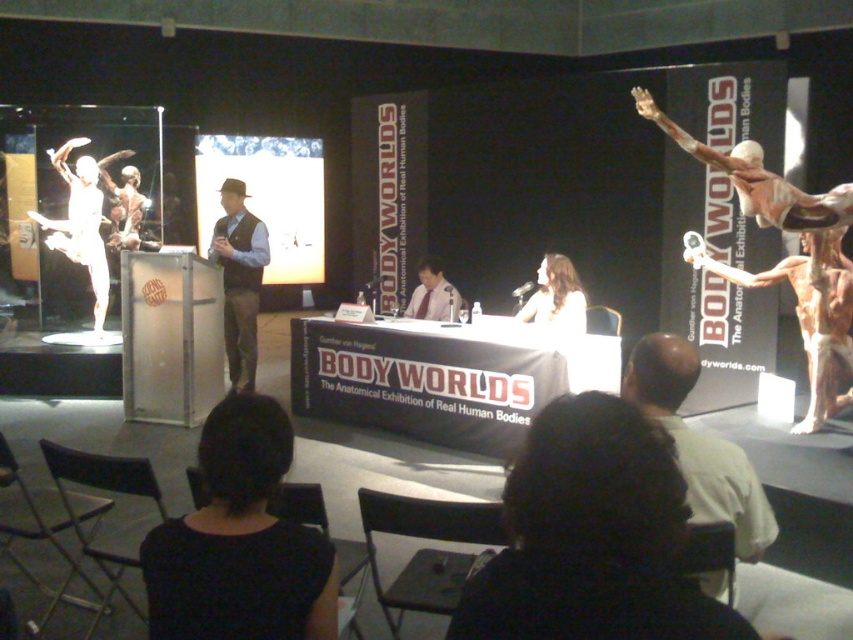
You are standing in the BODYWORLDS exhibition hall and notice a point marked at coordinates (x=512, y=480). If you want to place a small plant exactly 3 feet away from this point, will it be within the same room?

The point at (x=512, y=480) is 3.40 feet away from the viewer. Placing a plant 3 feet from this point would still be within the same room as the distance is relatively short and the exhibition hall is a single room.

You are attending the BODYWORLDS exhibition and need to move from the back of the room to the front. There are two points marked in the image. Which point, point (666, 371) or point (422, 275), is closer to the front of the room?

Point (666, 371) is in front of point (422, 275), so it is closer to the front of the room.